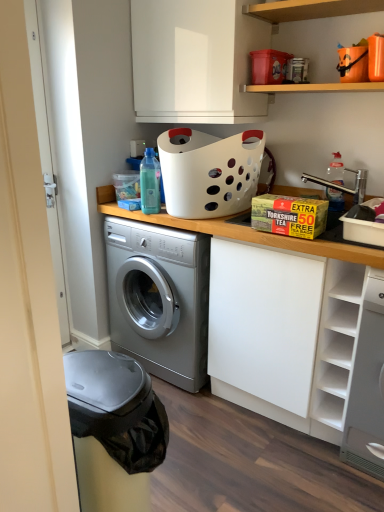
Question: Is white matte cabinet at center positioned beyond the bounds of clear plastic bottle at upper right, which is the first bottle in right-to-left order?

Choices:
 (A) no
 (B) yes

Answer: (B)

Question: From the image's perspective, does white matte cabinet at center appear higher than clear plastic bottle at upper right, which is the first bottle in right-to-left order?

Choices:
 (A) no
 (B) yes

Answer: (A)

Question: Does white matte cabinet at center appear on the left side of clear plastic bottle at upper right, placed as the 2th bottle when sorted from left to right?

Choices:
 (A) yes
 (B) no

Answer: (A)

Question: Is white matte cabinet at center looking in the opposite direction of clear plastic bottle at upper right, which is the first bottle in right-to-left order?

Choices:
 (A) yes
 (B) no

Answer: (B)

Question: From a real-world perspective, is white matte cabinet at center on top of clear plastic bottle at upper right, placed as the 2th bottle when sorted from left to right?

Choices:
 (A) yes
 (B) no

Answer: (B)

Question: Would you say clear plastic bottle at upper right, which is the first bottle in right-to-left order, is part of white matte cabinet at center's contents?

Choices:
 (A) yes
 (B) no

Answer: (B)

Question: Can we say white matte cabinet at center lies outside wooden shelf at upper center, which is the 1th shelf in top-to-bottom order?

Choices:
 (A) no
 (B) yes

Answer: (B)

Question: Are white matte cabinet at center and wooden shelf at upper center, which is the 1th shelf in top-to-bottom order, beside each other?

Choices:
 (A) yes
 (B) no

Answer: (B)

Question: From a real-world perspective, is white matte cabinet at center on top of wooden shelf at upper center, which is the 1th shelf in top-to-bottom order?

Choices:
 (A) no
 (B) yes

Answer: (A)

Question: Would you say white matte cabinet at center contains wooden shelf at upper center, placed as the second shelf when sorted from bottom to top?

Choices:
 (A) no
 (B) yes

Answer: (A)

Question: From the image's perspective, is white matte cabinet at center below wooden shelf at upper center, placed as the second shelf when sorted from bottom to top?

Choices:
 (A) no
 (B) yes

Answer: (B)

Question: Is white matte cabinet at center bigger than wooden shelf at upper center, placed as the second shelf when sorted from bottom to top?

Choices:
 (A) yes
 (B) no

Answer: (A)

Question: Can you confirm if white matte shelf at right, positioned as the 2th shelf in top-to-bottom order, is shorter than white glossy cabinet at upper center?

Choices:
 (A) no
 (B) yes

Answer: (A)